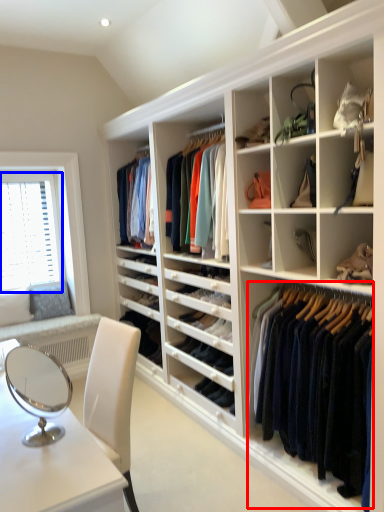
Question: Among these objects, which one is nearest to the camera, clothing (highlighted by a red box) or window screen (highlighted by a blue box)?

Choices:
 (A) clothing
 (B) window screen

Answer: (A)